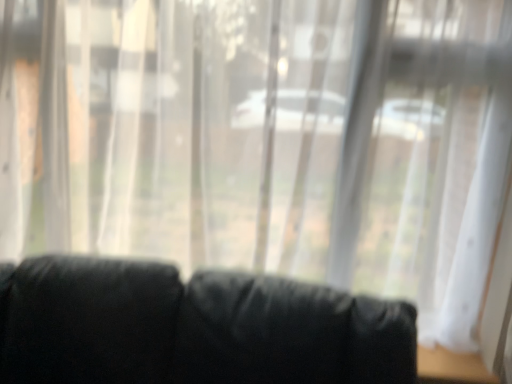
What is the approximate width of black leather couch at center?

28.46 inches.

I want to click on black leather couch at center, so click(192, 327).

Describe the element at coordinates (192, 327) in the screenshot. Image resolution: width=512 pixels, height=384 pixels. I see `black leather couch at center` at that location.

This screenshot has width=512, height=384. Identify the location of black leather couch at center. (192, 327).